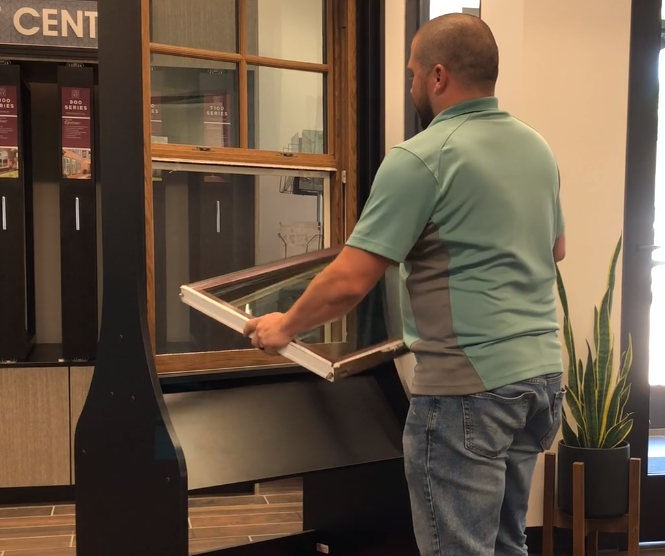
The height and width of the screenshot is (556, 665). Find the location of `plant`. plant is located at coordinates (590, 396).